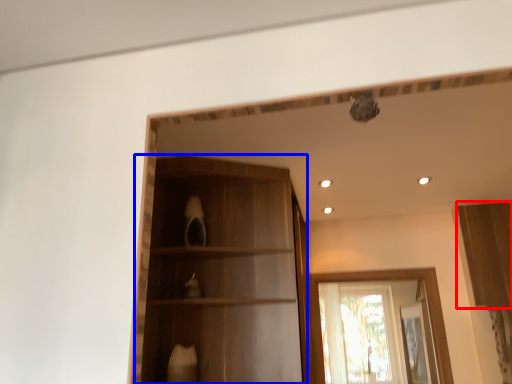
Question: Among these objects, which one is nearest to the camera, cabinetry (highlighted by a red box) or cabinetry (highlighted by a blue box)?

Choices:
 (A) cabinetry
 (B) cabinetry

Answer: (B)